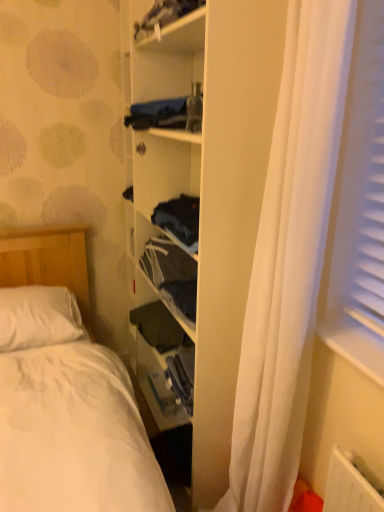
Question: Is white fabric curtain at center wider than dark blue fabric at upper center?

Choices:
 (A) no
 (B) yes

Answer: (B)

Question: Considering the relative positions of white fabric curtain at center and dark blue fabric at upper center in the image provided, is white fabric curtain at center to the right of dark blue fabric at upper center from the viewer's perspective?

Choices:
 (A) no
 (B) yes

Answer: (B)

Question: Can you confirm if white fabric curtain at center is bigger than dark blue fabric at upper center?

Choices:
 (A) yes
 (B) no

Answer: (A)

Question: From the image's perspective, is white fabric curtain at center above dark blue fabric at upper center?

Choices:
 (A) yes
 (B) no

Answer: (B)

Question: Is white fabric curtain at center positioned far away from dark blue fabric at upper center?

Choices:
 (A) no
 (B) yes

Answer: (A)

Question: From a real-world perspective, is dark blue fabric at upper center physically located above or below wooden bookshelf at center?

Choices:
 (A) below
 (B) above

Answer: (B)

Question: From their relative heights in the image, would you say dark blue fabric at upper center is taller or shorter than wooden bookshelf at center?

Choices:
 (A) short
 (B) tall

Answer: (A)

Question: Is dark blue fabric at upper center situated inside wooden bookshelf at center or outside?

Choices:
 (A) outside
 (B) inside

Answer: (B)

Question: Is point (137, 24) positioned closer to the camera than point (218, 245)?

Choices:
 (A) farther
 (B) closer

Answer: (A)

Question: Considering the positions of white soft pillow at left and dark blue fabric at upper center in the image, is white soft pillow at left wider or thinner than dark blue fabric at upper center?

Choices:
 (A) thin
 (B) wide

Answer: (B)

Question: Considering their positions, is white soft pillow at left located in front of or behind dark blue fabric at upper center?

Choices:
 (A) behind
 (B) front

Answer: (A)

Question: From a real-world perspective, is white soft pillow at left physically located above or below dark blue fabric at upper center?

Choices:
 (A) below
 (B) above

Answer: (A)

Question: From the image's perspective, is white soft pillow at left located above or below dark blue fabric at upper center?

Choices:
 (A) above
 (B) below

Answer: (B)

Question: Is white soft pillow at left spatially inside wooden bookshelf at center, or outside of it?

Choices:
 (A) outside
 (B) inside

Answer: (A)

Question: Would you say white soft pillow at left is to the left or to the right of wooden bookshelf at center in the picture?

Choices:
 (A) left
 (B) right

Answer: (A)